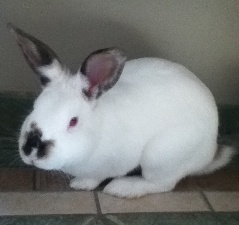
You are a GUI agent. You are given a task and a screenshot of the screen. Output one action in this format:
    pyautogui.click(x=<x>, y=<y>)
    Task: Click on the cream tile
    The height and width of the screenshot is (225, 239).
    Given the screenshot: What is the action you would take?
    pyautogui.click(x=153, y=206)